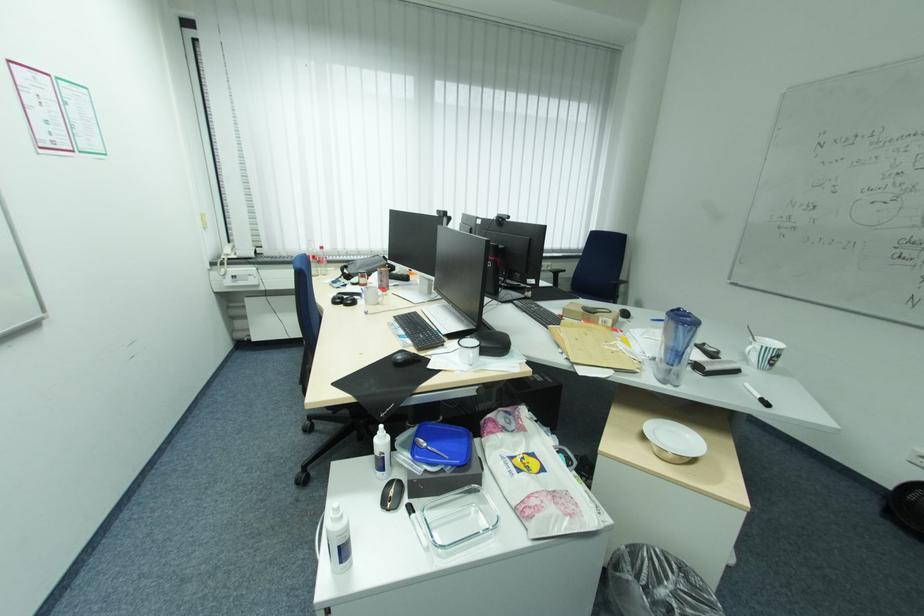
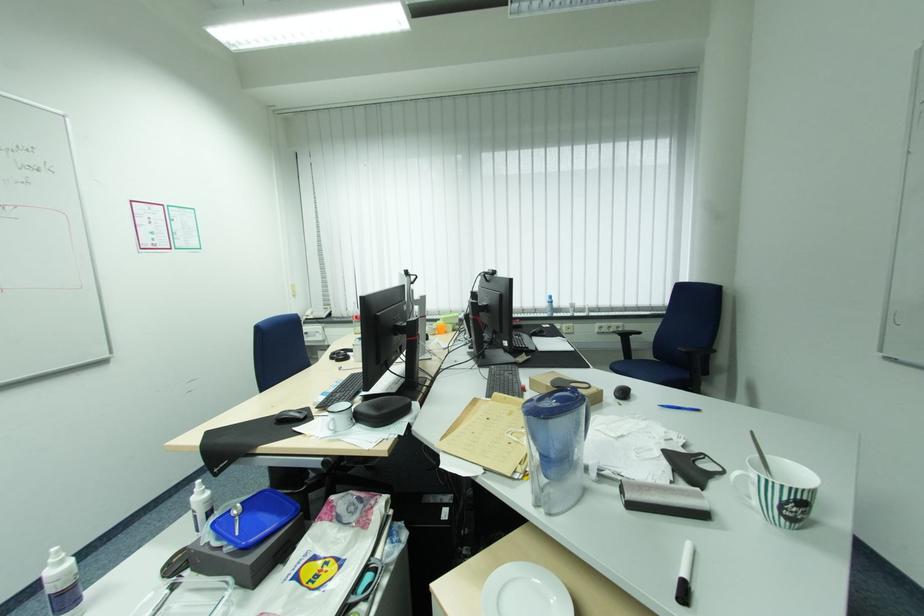
The point at (160, 471) is marked in the first image. Where is the corresponding point in the second image?

(193, 487)